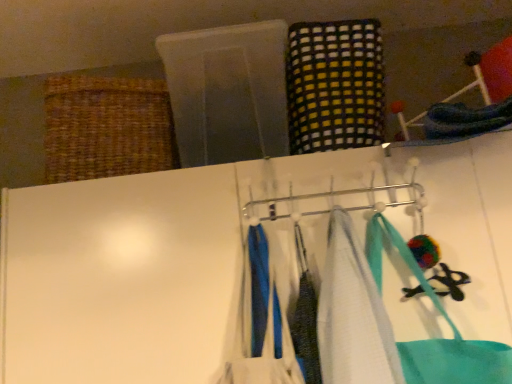
Question: Considering the relative sizes of white fabric towel at center and multicolored woven cloth at upper center, which is the first clothing in right-to-left order, in the image provided, is white fabric towel at center taller than multicolored woven cloth at upper center, which is the first clothing in right-to-left order,?

Choices:
 (A) no
 (B) yes

Answer: (B)

Question: From the image's perspective, is white fabric towel at center located beneath multicolored woven cloth at upper center, which ranks as the second clothing in left-to-right order?

Choices:
 (A) no
 (B) yes

Answer: (B)

Question: Does white fabric towel at center have a smaller size compared to multicolored woven cloth at upper center, which ranks as the second clothing in left-to-right order?

Choices:
 (A) yes
 (B) no

Answer: (A)

Question: Is white fabric towel at center shorter than multicolored woven cloth at upper center, placed as the 1th clothing when sorted from top to bottom?

Choices:
 (A) no
 (B) yes

Answer: (A)

Question: Would you consider white fabric towel at center to be distant from multicolored woven cloth at upper center, marked as the 2th clothing in a bottom-to-top arrangement?

Choices:
 (A) no
 (B) yes

Answer: (A)

Question: Does white fabric towel at center have a lesser width compared to multicolored woven cloth at upper center, marked as the second clothing in a front-to-back arrangement?

Choices:
 (A) no
 (B) yes

Answer: (B)

Question: Is metallic silver hanger at center positioned beyond the bounds of blue fabric at center, the 1th clothing positioned from the front?

Choices:
 (A) yes
 (B) no

Answer: (A)

Question: From the image's perspective, is metallic silver hanger at center below blue fabric at center, positioned as the 1th clothing in left-to-right order?

Choices:
 (A) no
 (B) yes

Answer: (A)

Question: Is metallic silver hanger at center closer to camera compared to blue fabric at center, the 1th clothing positioned from the front?

Choices:
 (A) no
 (B) yes

Answer: (A)

Question: Is metallic silver hanger at center far away from blue fabric at center, the 1th clothing positioned from the front?

Choices:
 (A) no
 (B) yes

Answer: (A)

Question: Could you tell me if metallic silver hanger at center is turned towards blue fabric at center, which is the second clothing in right-to-left order?

Choices:
 (A) no
 (B) yes

Answer: (A)

Question: Is blue fabric at center, which is the second clothing in right-to-left order, completely or partially inside metallic silver hanger at center?

Choices:
 (A) yes
 (B) no

Answer: (B)

Question: Can you confirm if white fabric towel at center is positioned to the right of metallic silver hanger at center?

Choices:
 (A) no
 (B) yes

Answer: (B)